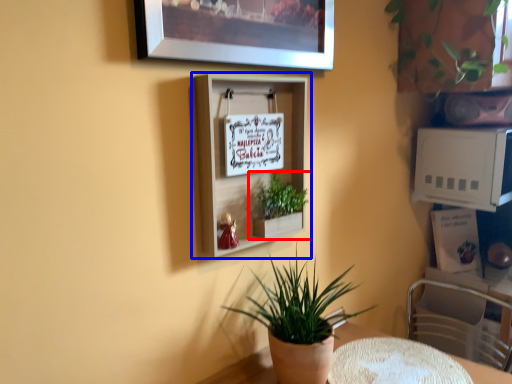
Question: Which object is further to the camera taking this photo, houseplant (highlighted by a red box) or shelf (highlighted by a blue box)?

Choices:
 (A) houseplant
 (B) shelf

Answer: (A)